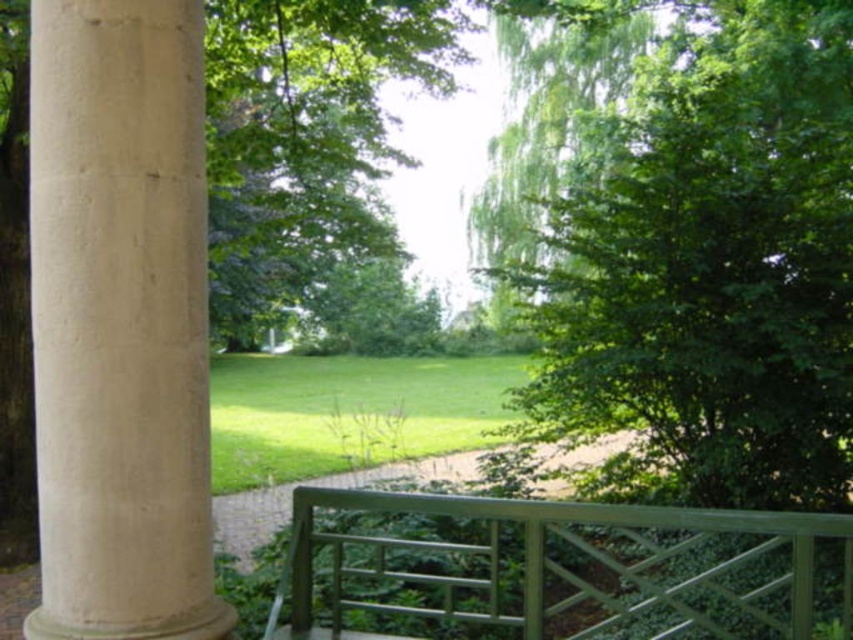
Question: Does green leafy tree at center come in front of beige stone column at left?

Choices:
 (A) no
 (B) yes

Answer: (A)

Question: Which point is farther to the camera?

Choices:
 (A) (45, 44)
 (B) (751, 548)
 (C) (817, 212)

Answer: (C)

Question: Is beige stone column at left above green painted wood railing at center?

Choices:
 (A) no
 (B) yes

Answer: (B)

Question: From the image, what is the correct spatial relationship of beige stone column at left in relation to green painted wood railing at center?

Choices:
 (A) left
 (B) right

Answer: (A)

Question: Which point is closer to the camera?

Choices:
 (A) (809, 396)
 (B) (132, 312)

Answer: (B)

Question: Which point is closer to the camera?

Choices:
 (A) (779, 234)
 (B) (192, 268)
 (C) (785, 595)

Answer: (B)